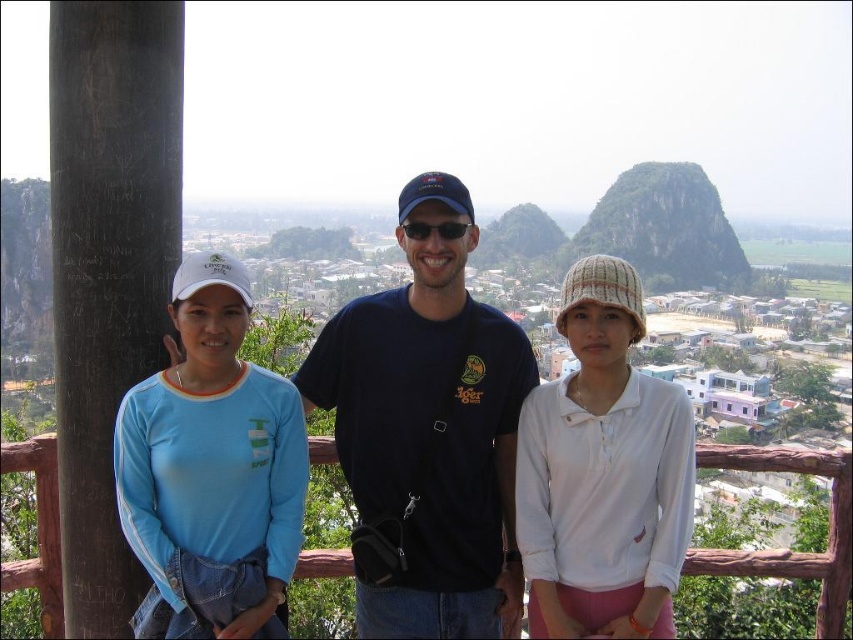
This screenshot has width=853, height=640. I want to click on black cotton t-shirt at center, so click(428, 426).

Can you confirm if black cotton t-shirt at center is wider than white knitted hat at center?

Yes, black cotton t-shirt at center is wider than white knitted hat at center.

This screenshot has width=853, height=640. I want to click on black cotton t-shirt at center, so click(428, 426).

Identify the location of black cotton t-shirt at center. This screenshot has height=640, width=853. (428, 426).

Looking at this image, who is positioned more to the right, matte blue shirt at center or light blue fabric shirt at left?

matte blue shirt at center is more to the right.

Does matte blue shirt at center have a greater width compared to light blue fabric shirt at left?

Indeed, matte blue shirt at center has a greater width compared to light blue fabric shirt at left.

Between point (646, 627) and point (218, 403), which one is positioned behind?

The point (646, 627) is behind.

You are a GUI agent. You are given a task and a screenshot of the screen. Output one action in this format:
    pyautogui.click(x=<x>, y=<y>)
    Task: Click on the matte blue shirt at center
    This screenshot has width=853, height=640.
    Given the screenshot: What is the action you would take?
    (488, 440)

Is point (486, 371) closer to viewer compared to point (456, 298)?

Yes.

Does matte blue shirt at center have a greater width compared to black cotton t-shirt at center?

Yes, matte blue shirt at center is wider than black cotton t-shirt at center.

Where is `matte blue shirt at center`? matte blue shirt at center is located at coordinates (488, 440).